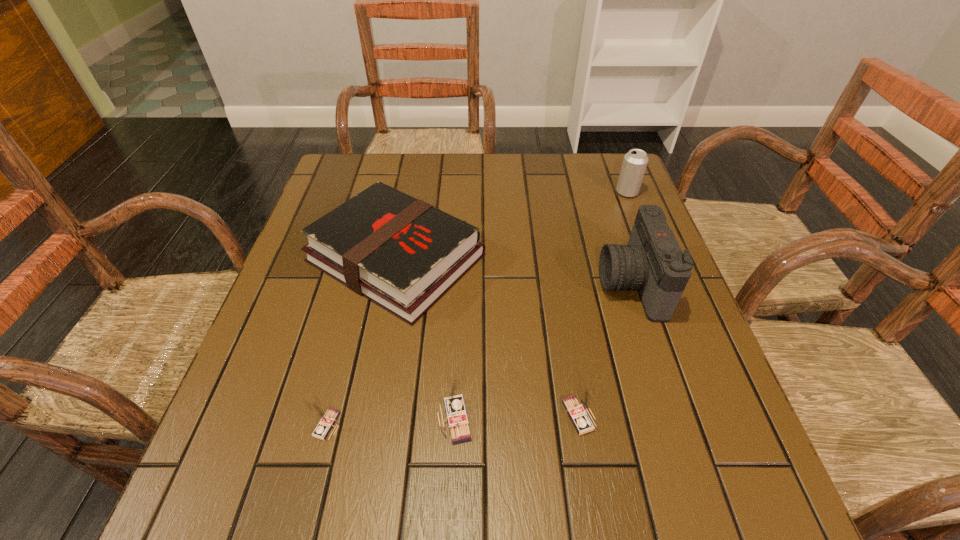
You are a GUI agent. You are given a task and a screenshot of the screen. Output one action in this format:
    pyautogui.click(x=<x>, y=<y>)
    Task: Click on the leftmost matchbox
    The image size is (960, 540).
    Given the screenshot: What is the action you would take?
    pyautogui.click(x=326, y=417)

Locate an element on the screen. This screenshot has height=540, width=960. the second matchbox from right to left is located at coordinates (453, 405).

In order to click on the third object from right to left in this screenshot , I will do `click(578, 408)`.

I want to click on the rightmost matchbox, so click(x=578, y=408).

Where is `hardback book`? The height and width of the screenshot is (540, 960). hardback book is located at coordinates (403, 254).

What are the coordinates of `beer can` in the screenshot? It's located at (634, 164).

Locate an element on the screen. The width and height of the screenshot is (960, 540). camera is located at coordinates (653, 263).

Where is `vacant space located on the right of the leftmost matchbox`? The height and width of the screenshot is (540, 960). vacant space located on the right of the leftmost matchbox is located at coordinates (466, 424).

Locate an element on the screen. The height and width of the screenshot is (540, 960). vacant space located on the left of the second matchbox from right to left is located at coordinates (363, 420).

Where is `free space located on the left of the second shortest matchbox`? The image size is (960, 540). free space located on the left of the second shortest matchbox is located at coordinates (372, 416).